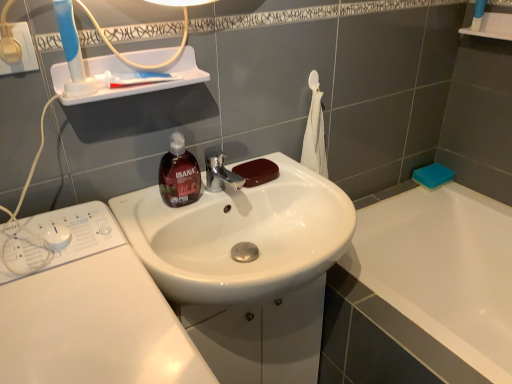
This screenshot has width=512, height=384. Find the location of `free location to the right of brown matte soap at sink, which is the 1th soap from left to right`. free location to the right of brown matte soap at sink, which is the 1th soap from left to right is located at coordinates (306, 183).